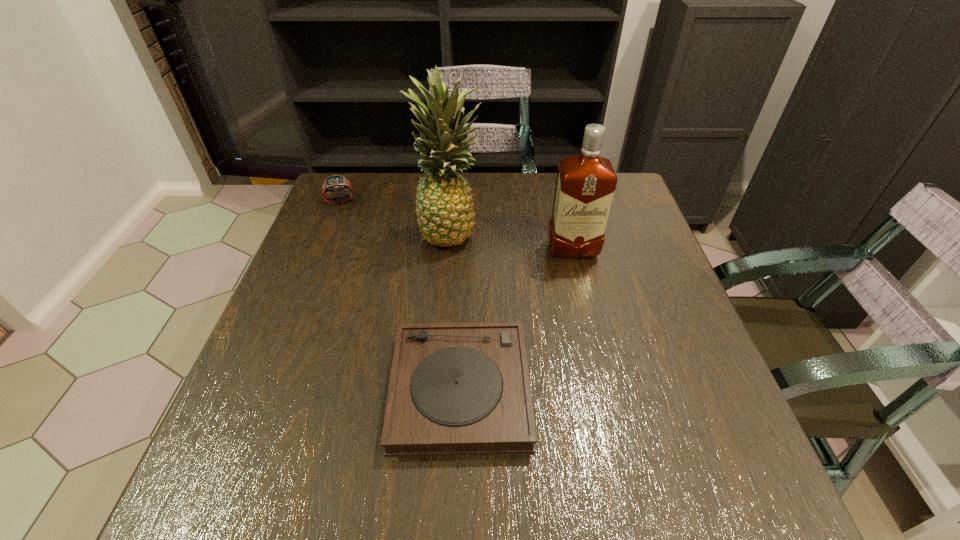
The image size is (960, 540). I want to click on pineapple, so click(x=444, y=206).

Where is `the rightmost object`? This screenshot has width=960, height=540. the rightmost object is located at coordinates (585, 185).

You are a GUI agent. You are given a task and a screenshot of the screen. Output one action in this format:
    pyautogui.click(x=<x>, y=<y>)
    Task: Click on the third shortest object
    Image resolution: width=960 pixels, height=540 pixels.
    Given the screenshot: What is the action you would take?
    pyautogui.click(x=585, y=185)

Identify the location of the leftmost object. (334, 183).

Where is `the second shortest object`? This screenshot has width=960, height=540. the second shortest object is located at coordinates (334, 183).

I want to click on the nearest object, so click(455, 388).

What are the coordinates of `phonograph record` in the screenshot? It's located at (455, 388).

Image resolution: width=960 pixels, height=540 pixels. In order to click on vacant space located on the left of the pineapple in this screenshot , I will do tap(331, 232).

At what (x,y) coordinates should I click in order to perform the action: click on free space located on the front label of the liquor. Please return your answer as a coordinate pair (x, y). Looking at the image, I should click on (610, 407).

You are a GUI agent. You are given a task and a screenshot of the screen. Output one action in this format:
    pyautogui.click(x=<x>, y=<y>)
    Task: Click on the free point located 0.070m on the right of the farthest object
    The width and height of the screenshot is (960, 540).
    Given the screenshot: What is the action you would take?
    pyautogui.click(x=379, y=201)